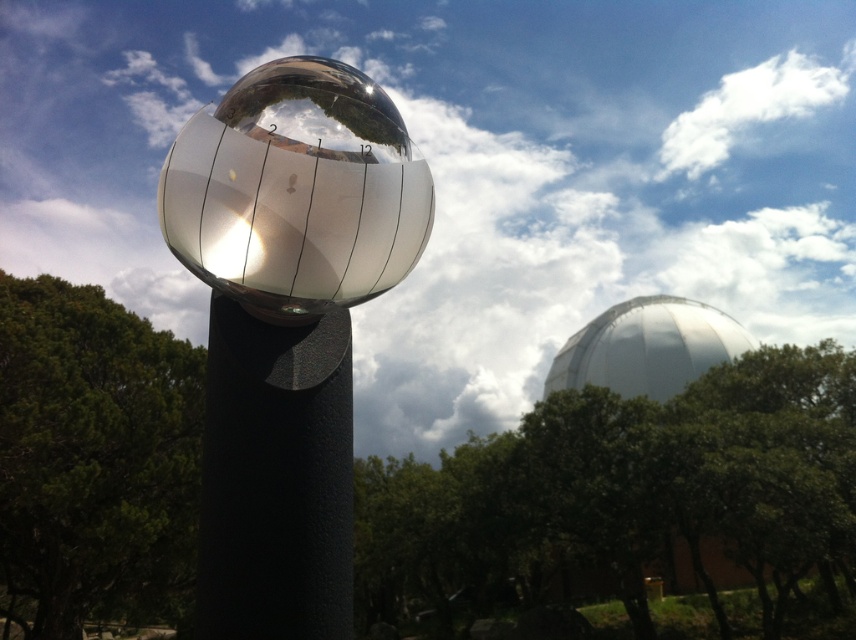
Question: Is green leafy tree at lower left smaller than black matte post at center?

Choices:
 (A) no
 (B) yes

Answer: (A)

Question: Is white fluffy cloud at upper center above polished silver sphere at center?

Choices:
 (A) yes
 (B) no

Answer: (A)

Question: Is green leafy tree at lower left closer to camera compared to black matte post at center?

Choices:
 (A) yes
 (B) no

Answer: (B)

Question: Which point is closer to the camera?

Choices:
 (A) (214, 416)
 (B) (384, 172)
 (C) (645, 435)

Answer: (B)

Question: Which point is farther from the camera taking this photo?

Choices:
 (A) (452, 420)
 (B) (1, 582)
 (C) (337, 182)
 (D) (272, 355)

Answer: (A)

Question: Estimate the real-world distances between objects in this image. Which object is closer to the green leafy tree at lower left?

Choices:
 (A) white glossy dome at upper right
 (B) black matte post at center
 (C) green leafy tree at center

Answer: (C)